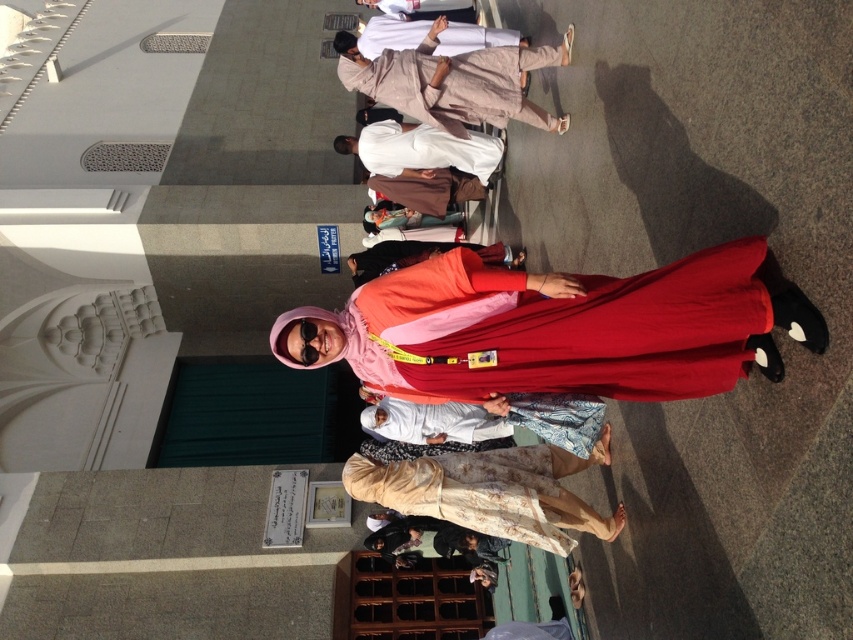
Is matte red dress at center to the right of white cotton robe at center from the viewer's perspective?

Indeed, matte red dress at center is positioned on the right side of white cotton robe at center.

Does matte red dress at center have a lesser width compared to white cotton robe at center?

Correct, matte red dress at center's width is less than white cotton robe at center's.

Which is behind, point (375, 356) or point (497, 161)?

The point (497, 161) is more distant.

Image resolution: width=853 pixels, height=640 pixels. What are the coordinates of `matte red dress at center` in the screenshot? It's located at (556, 328).

Is point (699, 380) positioned in front of point (469, 504)?

Yes, it is in front of point (469, 504).

Between point (321, 353) and point (537, 467), which one is positioned behind?

Point (537, 467)

Between point (770, 349) and point (363, 481), which one is positioned behind?

The point (363, 481) is more distant.

Locate an element on the screen. This screenshot has width=853, height=640. matte red dress at center is located at coordinates (556, 328).

Can you confirm if matte red dress at center is positioned to the right of beige fabric robe at upper center?

Indeed, matte red dress at center is positioned on the right side of beige fabric robe at upper center.

Which is above, matte red dress at center or beige fabric robe at upper center?

beige fabric robe at upper center is above.

At what (x,y) coordinates should I click in order to perform the action: click on matte red dress at center. Please return your answer as a coordinate pair (x, y). Looking at the image, I should click on (556, 328).